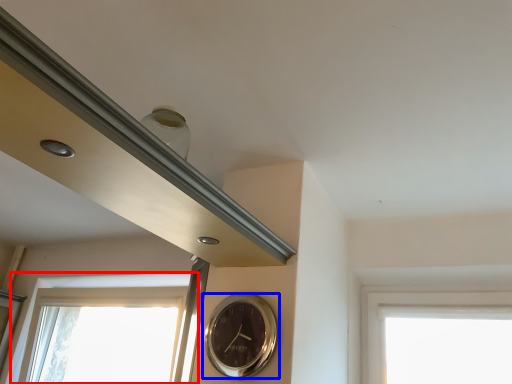
Question: Which of the following is the farthest to the observer, window (highlighted by a red box) or wall clock (highlighted by a blue box)?

Choices:
 (A) window
 (B) wall clock

Answer: (A)